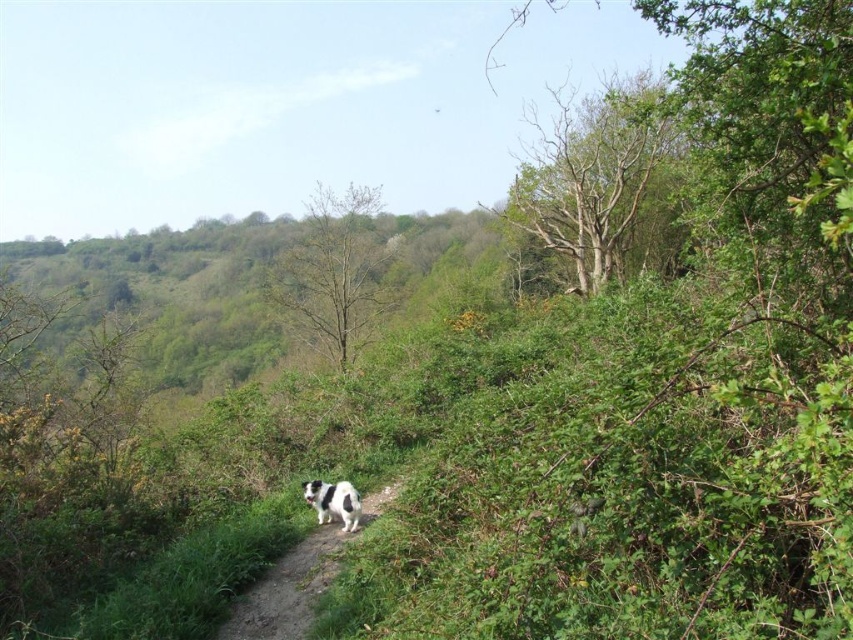
Does point (219, 634) come closer to viewer compared to point (318, 500)?

That is True.

Does white fur dog at center appear on the left side of black and white fur dog at center?

Correct, you'll find white fur dog at center to the left of black and white fur dog at center.

Does point (300, 580) come farther from viewer compared to point (317, 515)?

No, (300, 580) is in front of (317, 515).

What are the coordinates of `white fur dog at center` in the screenshot? It's located at (287, 589).